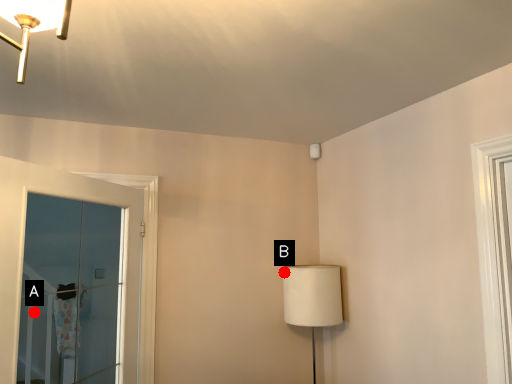
Question: Two points are circled on the image, labeled by A and B beside each circle. Among these points, which one is nearest to the camera?

Choices:
 (A) A is closer
 (B) B is closer

Answer: (B)